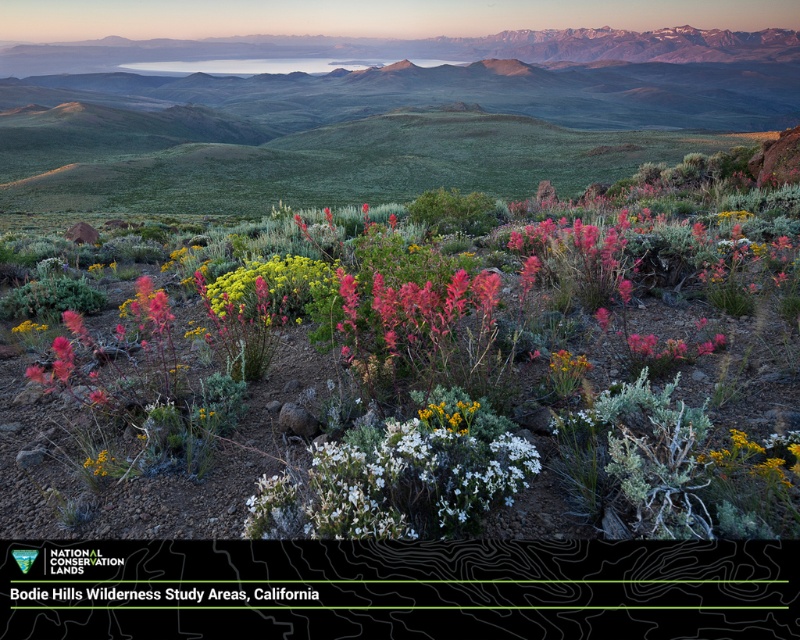
Is green grassy mountain range at upper center taller than green leafy plant at center?

Yes.

The image size is (800, 640). What do you see at coordinates (480, 77) in the screenshot?
I see `green grassy mountain range at upper center` at bounding box center [480, 77].

Locate an element on the screen. This screenshot has height=640, width=800. green grassy mountain range at upper center is located at coordinates (480, 77).

Is vivid crimson petals at center positioned before green leafy plant at center?

Yes, vivid crimson petals at center is in front of green leafy plant at center.

Is vivid crimson petals at center smaller than green leafy plant at center?

No, vivid crimson petals at center is not smaller than green leafy plant at center.

Measure the distance between point (486, 346) and camera.

3.94 meters

Where is `vivid crimson petals at center`? This screenshot has width=800, height=640. vivid crimson petals at center is located at coordinates (424, 321).

Can you confirm if green leafy plant at center is wider than yellow textured flower at center-right?

Correct, the width of green leafy plant at center exceeds that of yellow textured flower at center-right.

Is green leafy plant at center taller than yellow textured flower at center-right?

Correct, green leafy plant at center is much taller as yellow textured flower at center-right.

This screenshot has height=640, width=800. What do you see at coordinates (268, 282) in the screenshot?
I see `green leafy plant at center` at bounding box center [268, 282].

Find the location of a particular element. The width and height of the screenshot is (800, 640). green leafy plant at center is located at coordinates (268, 282).